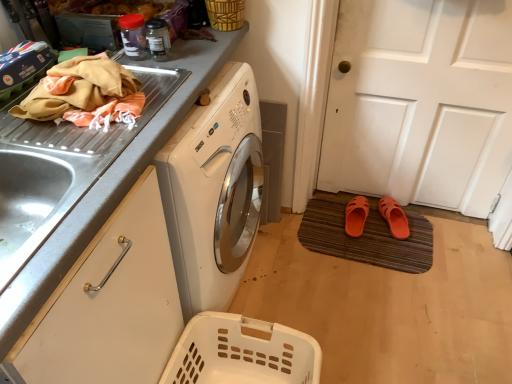
Question: Looking at their shapes, would you say metallic gray countertop at upper left is wider or thinner than brown textured doormat at lower right?

Choices:
 (A) thin
 (B) wide

Answer: (B)

Question: From the image's perspective, relative to brown textured doormat at lower right, is metallic gray countertop at upper left above or below?

Choices:
 (A) above
 (B) below

Answer: (A)

Question: Which object is the farthest from the orange rubber slipper at lower center, arranged as the first footwear when viewed from the left?

Choices:
 (A) white plastic laundry basket at lower center, the 2th basket when ordered from top to bottom
 (B) woven bamboo basket at upper center, the first basket when ordered from top to bottom
 (C) orange rubber sandals at lower right, which appears as the 2th footwear when viewed from the left
 (D) brown textured doormat at lower right
 (E) white matte door at lower right

Answer: (B)

Question: Which is farther from the orange fabric at upper left?

Choices:
 (A) woven bamboo basket at upper center, the first basket when ordered from top to bottom
 (B) white matte door at lower right
 (C) brown textured doormat at lower right
 (D) orange rubber slipper at lower center, arranged as the first footwear when viewed from the left
 (E) white plastic laundry basket at lower center, the 2th basket when ordered from top to bottom

Answer: (D)